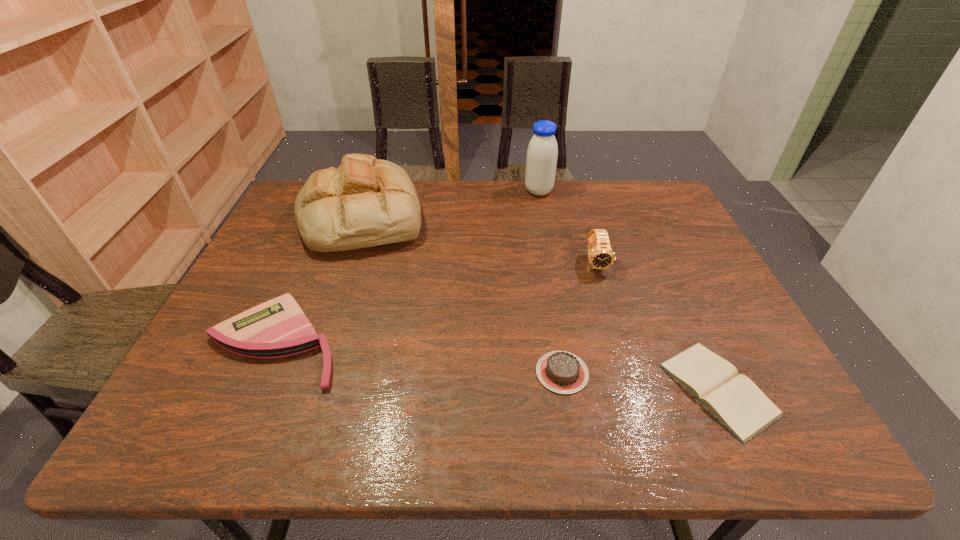
I want to click on object at the far left corner, so click(365, 202).

Find the location of a particular element. The height and width of the screenshot is (540, 960). object at the near right corner is located at coordinates point(733,399).

Find the location of `vacant space at the far edge of the desktop`. vacant space at the far edge of the desktop is located at coordinates (621, 221).

This screenshot has width=960, height=540. Identify the location of vacant space at the near edge of the desktop. (660, 407).

In the image, there is a desktop. Where is `vacant space at the left edge`? The image size is (960, 540). vacant space at the left edge is located at coordinates (282, 236).

Locate an element on the screen. vacant region at the right edge of the desktop is located at coordinates (693, 249).

Find the location of a particular element. free point at the near left corner is located at coordinates (228, 442).

This screenshot has width=960, height=540. In the image, there is a desktop. What are the coordinates of `blank space at the far right corner` in the screenshot? It's located at (647, 204).

In the image, there is a desktop. Where is `free region at the near right corner`? This screenshot has height=540, width=960. free region at the near right corner is located at coordinates (796, 434).

Locate an element on the screen. blank region between the soya milk and the Bible is located at coordinates (628, 290).